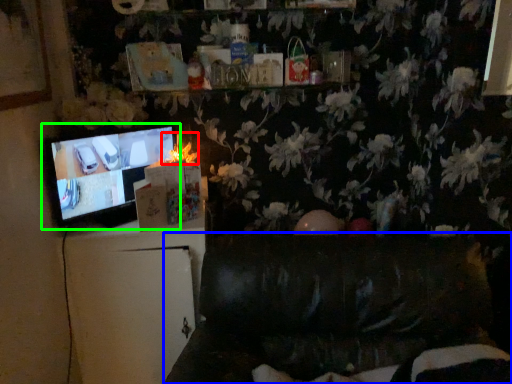
Question: Estimate the real-world distances between objects in this image. Which object is closer to flower (highlighted by a red box), furniture (highlighted by a blue box) or television (highlighted by a green box)?

Choices:
 (A) furniture
 (B) television

Answer: (B)